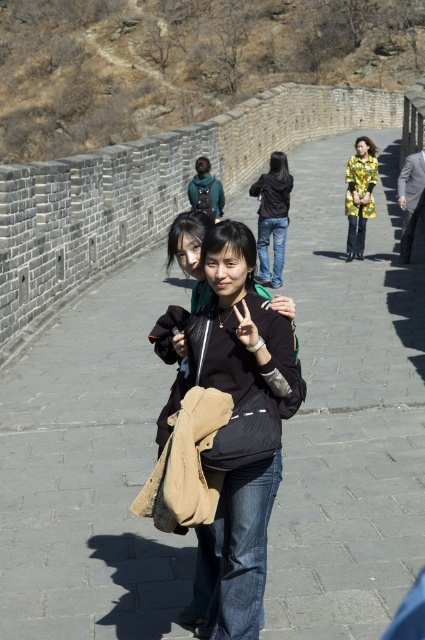
You are a photographer trying to capture a photo of the two tourists on the Great Wall. You want to ensure both the black denim jeans at center and the yellow metallic jacket at center are clearly visible in the frame. Based on their positions, which object should you focus on to ensure both are in focus?

The black denim jeans at center is wider than the yellow metallic jacket at center, so focusing on the black denim jeans at center would ensure both are in focus.

You are standing at the Great Wall and want to take a photo of the two points marked in the image. Which point, point [249,380] or point [277,253], is closer to your camera position?

Point [249,380] is closer to the camera than point [277,253].

You are a photographer trying to capture the two tourists on the Great Wall. You want to ensure that the black denim jeans at center and the yellow metallic jacket at center are both visible in the photo. Based on their positions, which item should you focus on first to ensure both are in frame?

The black denim jeans at center is to the left of the yellow metallic jacket at center. Therefore, focusing on the black denim jeans at center first will ensure the yellow metallic jacket at center remains in the frame to its right.